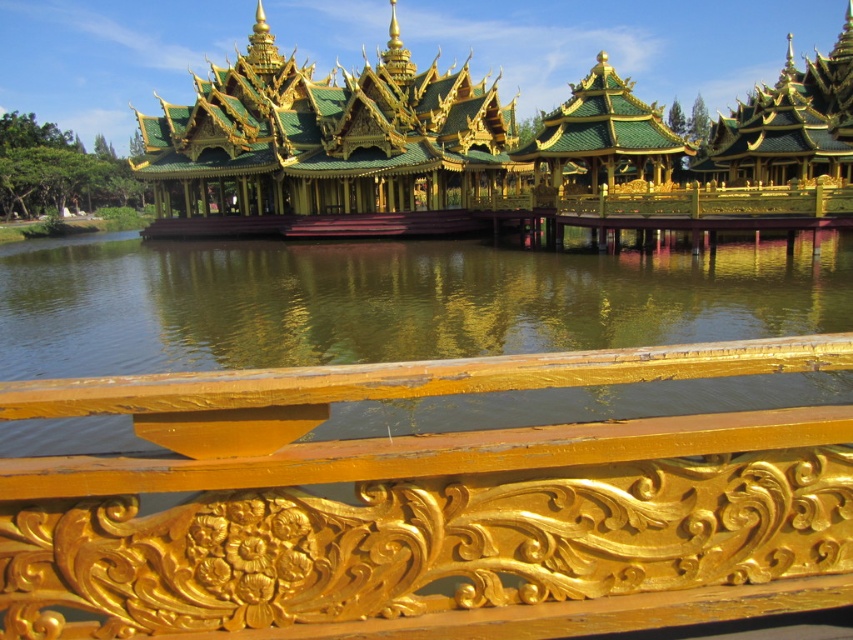
Question: Is green reflective water at center below gold/gilded wood palace at center?

Choices:
 (A) no
 (B) yes

Answer: (B)

Question: Can you confirm if green reflective water at center is bigger than gold/gilded wood palace at center?

Choices:
 (A) yes
 (B) no

Answer: (B)

Question: Can you confirm if gold carved wood rail at center is positioned to the right of green reflective water at center?

Choices:
 (A) no
 (B) yes

Answer: (B)

Question: Among these points, which one is farthest from the camera?

Choices:
 (A) (647, 380)
 (B) (717, 154)
 (C) (357, 337)

Answer: (B)

Question: Estimate the real-world distances between objects in this image. Which object is farther from the gold carved wood rail at center?

Choices:
 (A) gold/gilded wood palace at center
 (B) green reflective water at center

Answer: (A)

Question: Which object is positioned closest to the gold/gilded wood palace at center?

Choices:
 (A) green reflective water at center
 (B) gold carved wood rail at center

Answer: (A)